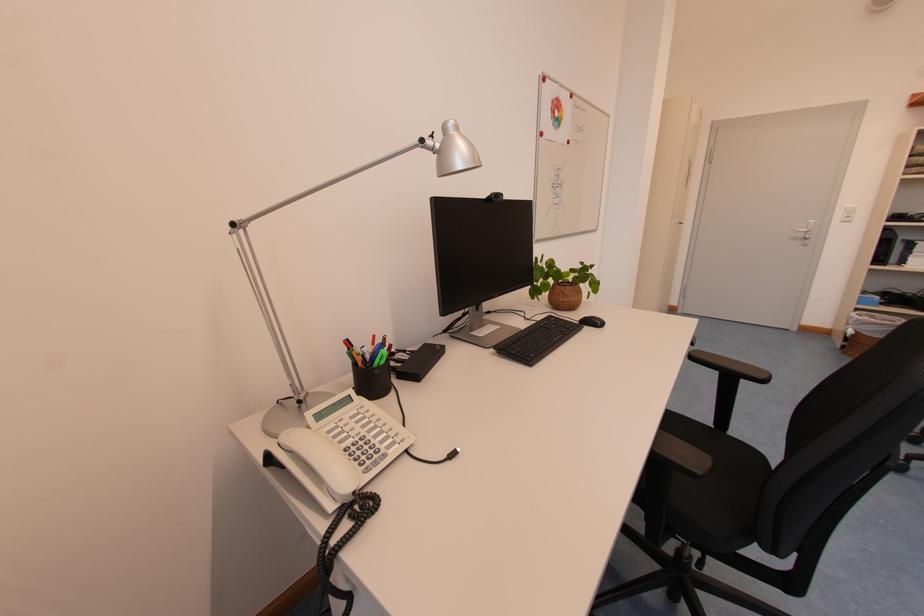
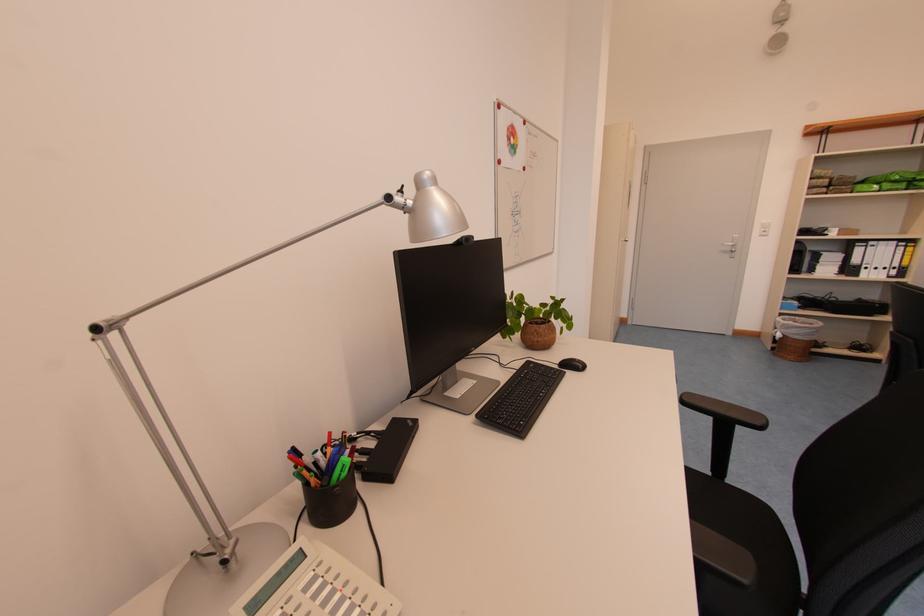
Locate, in the second image, the point that corresponds to pixel 808 238 in the first image.

(736, 252)